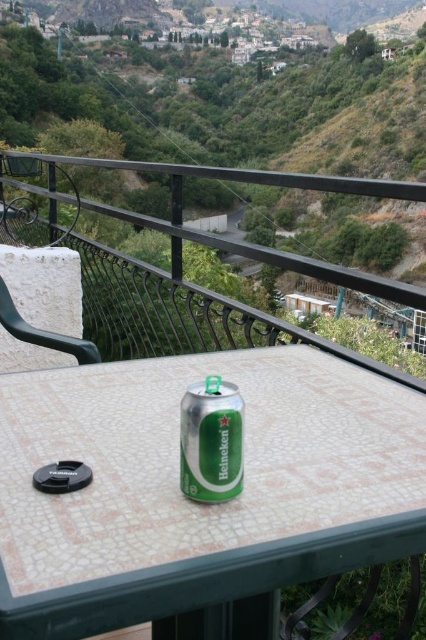
Can you confirm if metallic green can at center is smaller than green metallic can at center?

Incorrect, metallic green can at center is not smaller in size than green metallic can at center.

The height and width of the screenshot is (640, 426). What do you see at coordinates (195, 502) in the screenshot?
I see `metallic green can at center` at bounding box center [195, 502].

What do you see at coordinates (195, 502) in the screenshot? This screenshot has height=640, width=426. I see `metallic green can at center` at bounding box center [195, 502].

At what (x,y) coordinates should I click in order to perform the action: click on metallic green can at center. Please return your answer as a coordinate pair (x, y). This screenshot has width=426, height=640. Looking at the image, I should click on (195, 502).

Does metallic green can at center appear over green plastic chair at upper left?

Actually, metallic green can at center is below green plastic chair at upper left.

Which is in front, point (210, 508) or point (94, 346)?

Point (210, 508)

Which is in front, point (88, 608) or point (0, 312)?

Point (88, 608) is in front.

Find the location of a particular element. metallic green can at center is located at coordinates (195, 502).

Is black wrought iron railing at upper center bigger than green plastic chair at upper left?

Yes.

Does black wrought iron railing at upper center come behind green plastic chair at upper left?

Yes.

Which is behind, point (290, 184) or point (83, 346)?

Positioned behind is point (290, 184).

The height and width of the screenshot is (640, 426). I want to click on black wrought iron railing at upper center, so click(x=235, y=240).